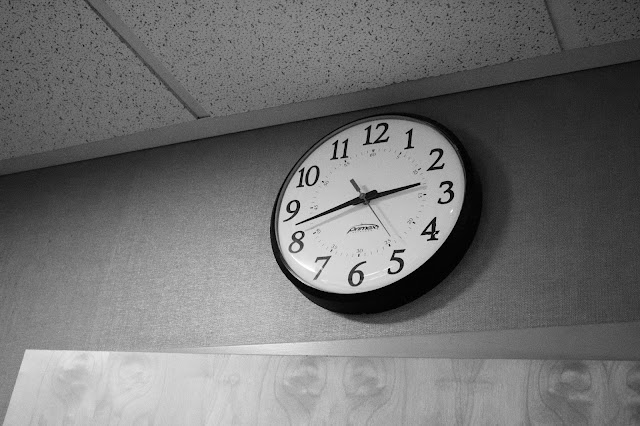
Identify the location of wall. (587, 243).